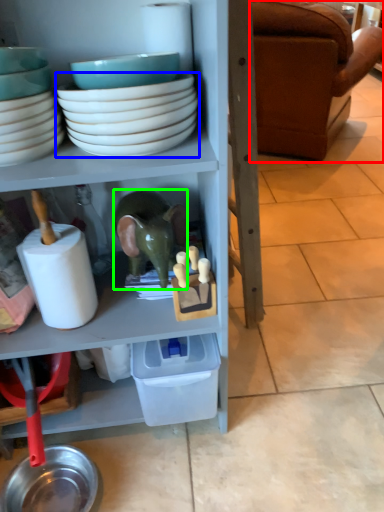
Question: Which object is positioned closest to studio couch (highlighted by a red box)? Select from bowl (highlighted by a blue box) and toy (highlighted by a green box).

Choices:
 (A) bowl
 (B) toy

Answer: (B)